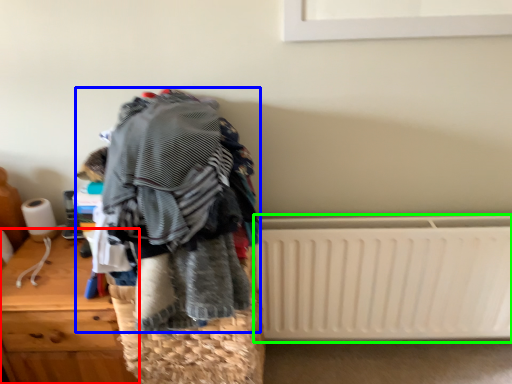
Question: Estimate the real-world distances between objects in this image. Which object is closer to furniture (highlighted by a red box), textile (highlighted by a blue box) or radiator (highlighted by a green box)?

Choices:
 (A) textile
 (B) radiator

Answer: (A)